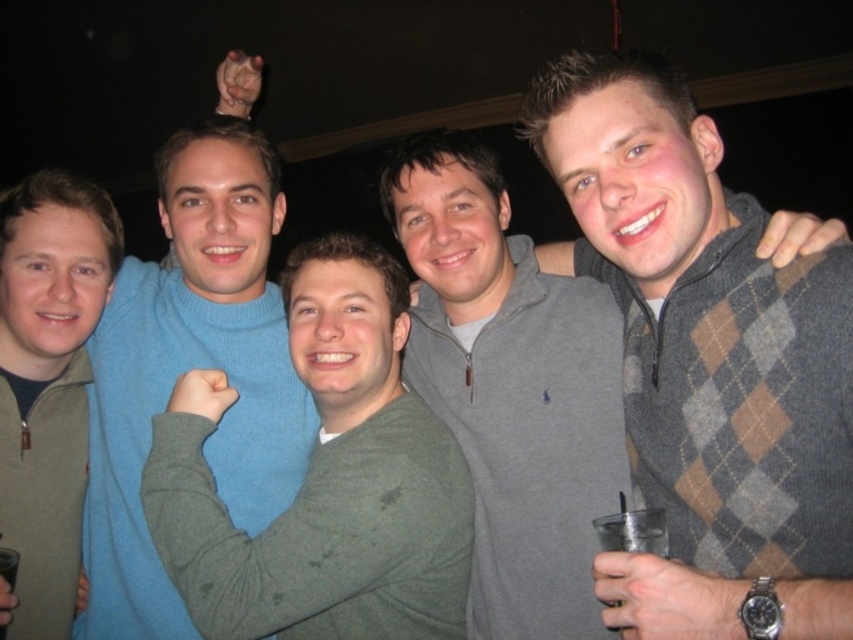
Question: Does green fuzzy sweater at center appear under matte blue sweater at center?

Choices:
 (A) no
 (B) yes

Answer: (B)

Question: Which object is the farthest from the green fuzzy sweater at center?

Choices:
 (A) matte blue sweater at center
 (B) gray argyle sweater at center
 (C) matte green sweater at left

Answer: (C)

Question: Which point is closer to the camera?

Choices:
 (A) (206, 228)
 (B) (12, 362)
 (C) (410, 477)

Answer: (C)

Question: Estimate the real-world distances between objects in this image. Which object is closer to the matte blue sweater at center?

Choices:
 (A) green fuzzy sweater at center
 (B) gray argyle sweater at center
 (C) matte green sweater at left

Answer: (C)

Question: Is gray argyle sweater at center below matte blue sweater at center?

Choices:
 (A) no
 (B) yes

Answer: (B)

Question: Where is gray argyle sweater at center located in relation to matte green sweater at left in the image?

Choices:
 (A) left
 (B) right

Answer: (B)